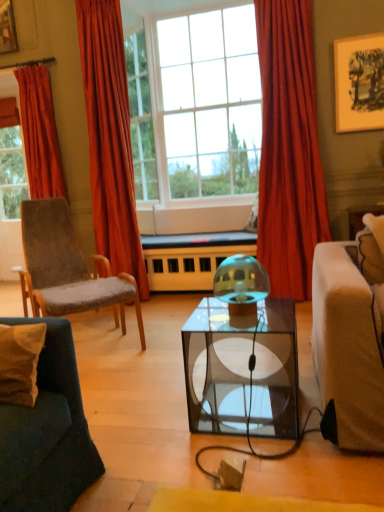
The width and height of the screenshot is (384, 512). What are the coordinates of `free space underneath transparent glass coffee table at center (from a real-world perspective)` in the screenshot? It's located at (248, 408).